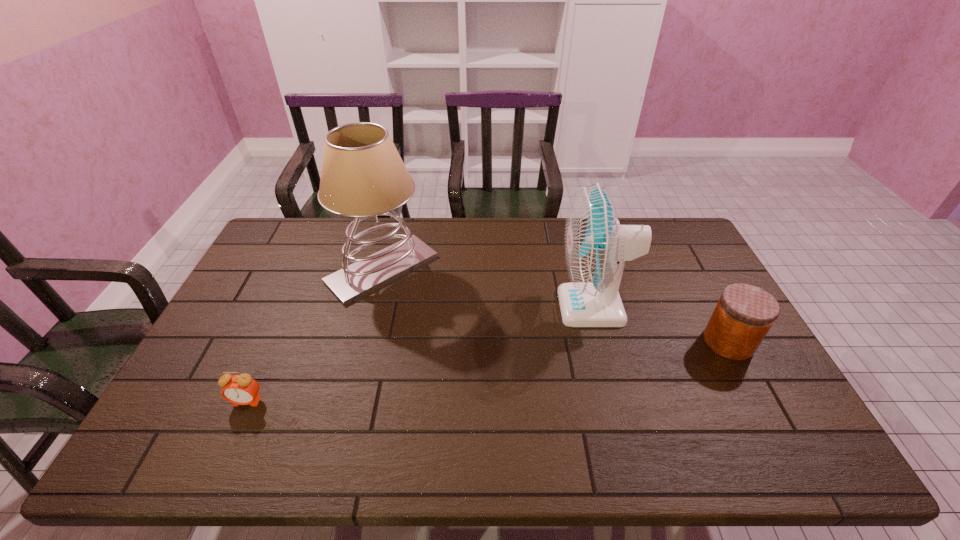
Find the location of a particular element. vacant space that is in between the tallest object and the rightmost object is located at coordinates (555, 306).

You are a GUI agent. You are given a task and a screenshot of the screen. Output one action in this format:
    pyautogui.click(x=<x>, y=<y>)
    Task: Click on the vacant area that lies between the jar and the leftmost object
    The image size is (960, 540).
    Given the screenshot: What is the action you would take?
    pyautogui.click(x=488, y=372)

The image size is (960, 540). I want to click on blank region between the third shortest object and the tallest object, so click(488, 288).

Find the location of a particular element. This screenshot has width=960, height=540. vacant point located between the shortest object and the table lamp is located at coordinates (315, 335).

Locate an element on the screen. The width and height of the screenshot is (960, 540). vacant area between the rightmost object and the fan is located at coordinates (660, 325).

Locate an element on the screen. vacant space that is in between the leftmost object and the second shortest object is located at coordinates (488, 372).

Image resolution: width=960 pixels, height=540 pixels. Identify the location of free space between the tallest object and the nearest object. (315, 335).

At what (x,y) coordinates should I click in order to perform the action: click on vacant area that lies between the fan and the third object from right to left. Please return your answer as a coordinate pair (x, y). The width and height of the screenshot is (960, 540). Looking at the image, I should click on (488, 288).

You are a GUI agent. You are given a task and a screenshot of the screen. Output one action in this format:
    pyautogui.click(x=<x>, y=<y>)
    Task: Click on the free space between the jar and the nearest object
    The image size is (960, 540).
    Given the screenshot: What is the action you would take?
    pyautogui.click(x=488, y=372)

In order to click on vacant area that lies between the third object from right to left and the third object from left to right in this screenshot , I will do `click(488, 288)`.